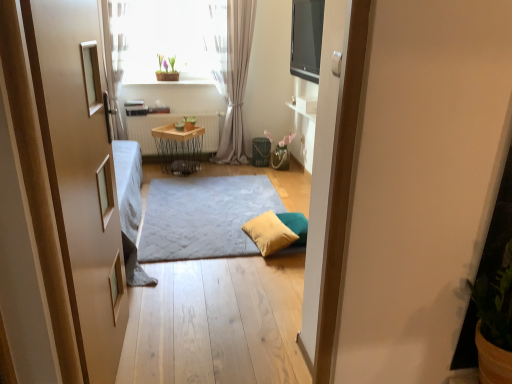
Locate an element on the screen. Image resolution: width=512 pixels, height=384 pixels. unoccupied space behind wooden door at left is located at coordinates (185, 309).